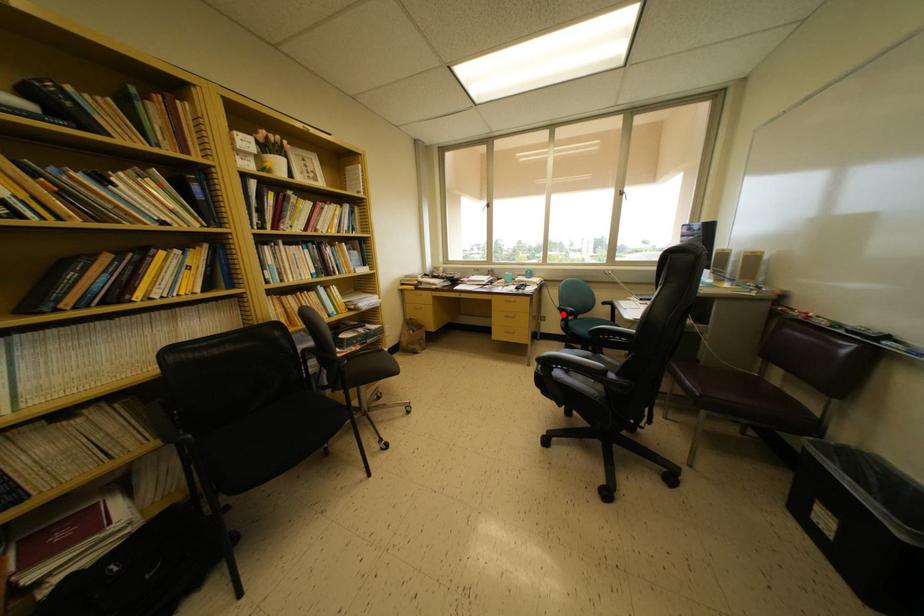
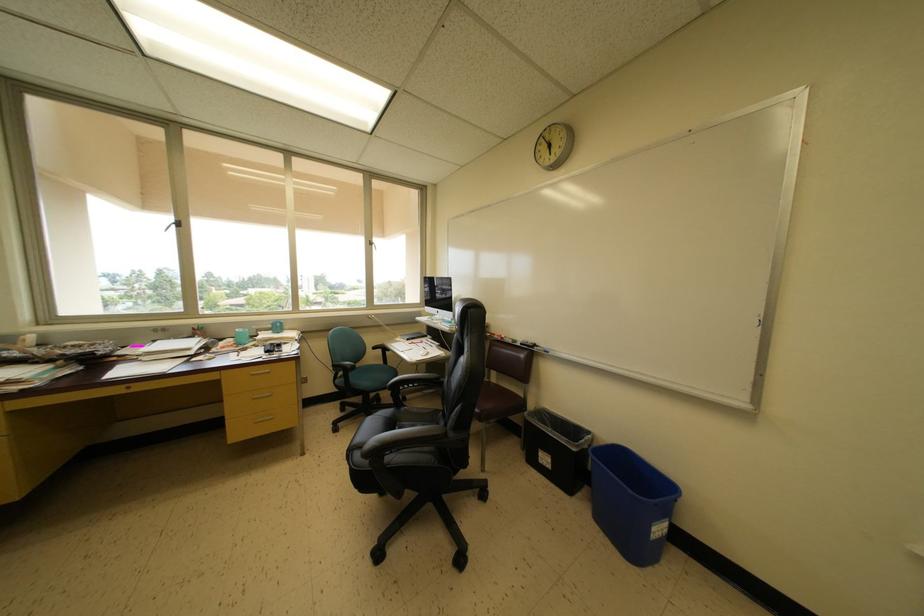
Where in the second image is the point corresponding to the highlighted location from the first image?

(338, 371)